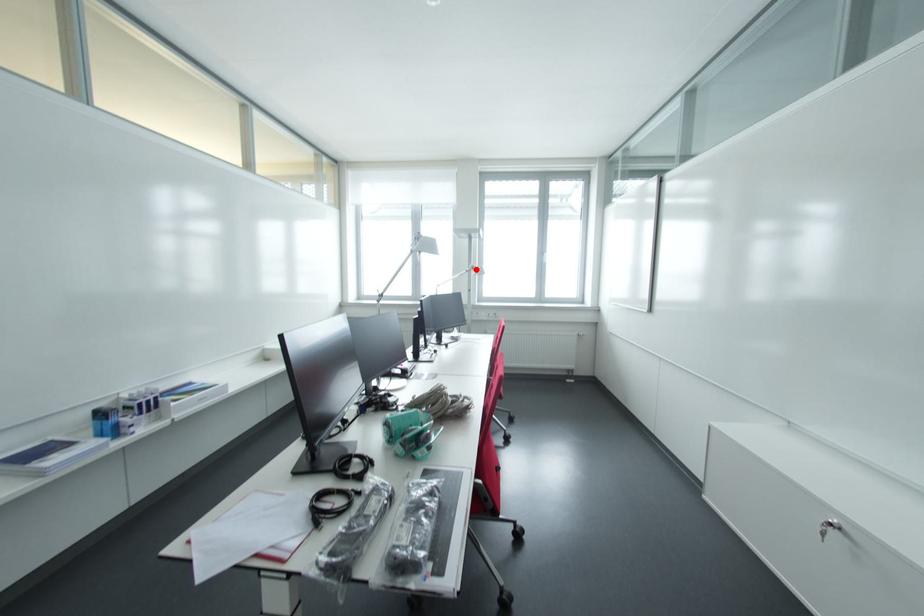
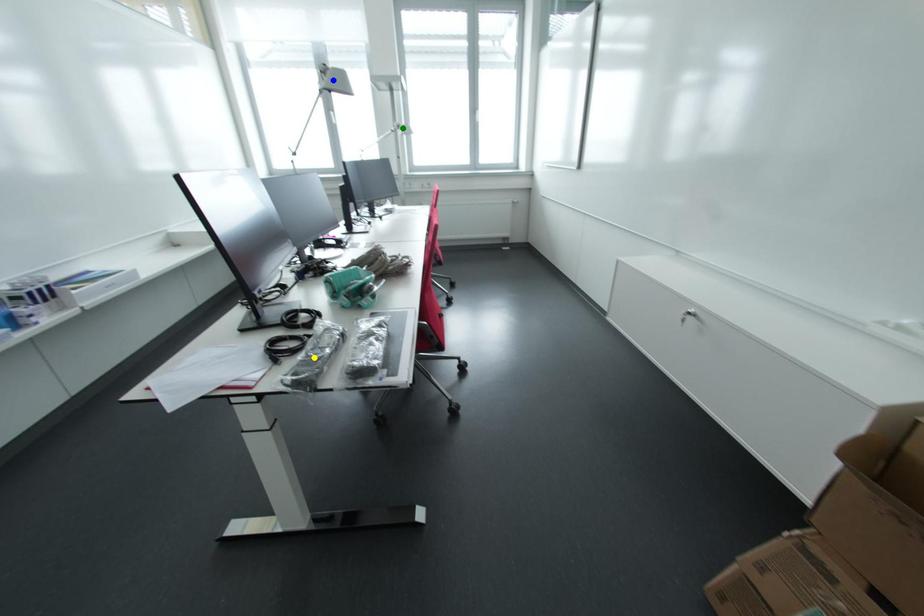
Question: I am providing you with two images of the same scene from different viewpoints. A red point is marked on the first image. You are given multiple points on the second image. In image 2, which mark is for the same physical point as the one in image 1?

Choices:
 (A) yellow point
 (B) green point
 (C) blue point

Answer: (B)